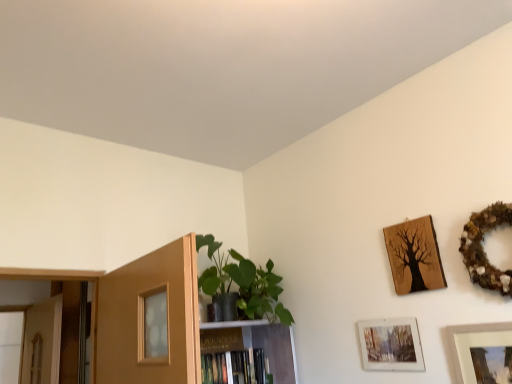
Question: Is wooden picture frame at upper right, marked as the fourth picture frame in a top-to-bottom arrangement, positioned behind matte glass picture frame at lower right, which is the 2th picture frame in bottom-to-top order?

Choices:
 (A) yes
 (B) no

Answer: (B)

Question: Is wooden picture frame at upper right, marked as the fourth picture frame in a top-to-bottom arrangement, to the left of matte glass picture frame at lower right, the 3th picture frame positioned from the top, from the viewer's perspective?

Choices:
 (A) yes
 (B) no

Answer: (B)

Question: Considering the relative sizes of wooden picture frame at upper right, marked as the fourth picture frame in a top-to-bottom arrangement, and matte glass picture frame at lower right, which is the 2th picture frame in bottom-to-top order, in the image provided, is wooden picture frame at upper right, marked as the fourth picture frame in a top-to-bottom arrangement, smaller than matte glass picture frame at lower right, which is the 2th picture frame in bottom-to-top order,?

Choices:
 (A) yes
 (B) no

Answer: (B)

Question: Is wooden picture frame at upper right, the 1th picture frame positioned from the bottom, facing towards matte glass picture frame at lower right, the 3th picture frame positioned from the top?

Choices:
 (A) yes
 (B) no

Answer: (B)

Question: Would you say wooden picture frame at upper right, marked as the fourth picture frame in a top-to-bottom arrangement, is a long distance from matte glass picture frame at lower right, which is the 2th picture frame in bottom-to-top order?

Choices:
 (A) no
 (B) yes

Answer: (A)

Question: Is wooden tree art at upper right, acting as the 3th picture frame starting from the bottom, inside the boundaries of hardcover book at center, or outside?

Choices:
 (A) outside
 (B) inside

Answer: (A)

Question: From the image's perspective, is wooden tree art at upper right, acting as the 3th picture frame starting from the bottom, located above or below hardcover book at center?

Choices:
 (A) below
 (B) above

Answer: (B)

Question: From a real-world perspective, is wooden tree art at upper right, placed as the second picture frame when sorted from top to bottom, positioned above or below hardcover book at center?

Choices:
 (A) above
 (B) below

Answer: (A)

Question: Is wooden tree art at upper right, acting as the 3th picture frame starting from the bottom, wider or thinner than hardcover book at center?

Choices:
 (A) thin
 (B) wide

Answer: (A)

Question: From the image's perspective, is green matte plant at center positioned above or below hardcover book at center?

Choices:
 (A) above
 (B) below

Answer: (A)

Question: In terms of size, does green matte plant at center appear bigger or smaller than hardcover book at center?

Choices:
 (A) small
 (B) big

Answer: (B)

Question: In terms of width, does green matte plant at center look wider or thinner when compared to hardcover book at center?

Choices:
 (A) thin
 (B) wide

Answer: (B)

Question: From a real-world perspective, is green matte plant at center physically located above or below hardcover book at center?

Choices:
 (A) below
 (B) above

Answer: (B)

Question: Visually, is matte glass picture frame at lower right, the 3th picture frame positioned from the top, positioned to the left or to the right of wooden wreath at upper right, acting as the 4th picture frame starting from the bottom?

Choices:
 (A) left
 (B) right

Answer: (A)

Question: Do you think matte glass picture frame at lower right, the 3th picture frame positioned from the top, is within wooden wreath at upper right, acting as the 4th picture frame starting from the bottom, or outside of it?

Choices:
 (A) outside
 (B) inside

Answer: (A)